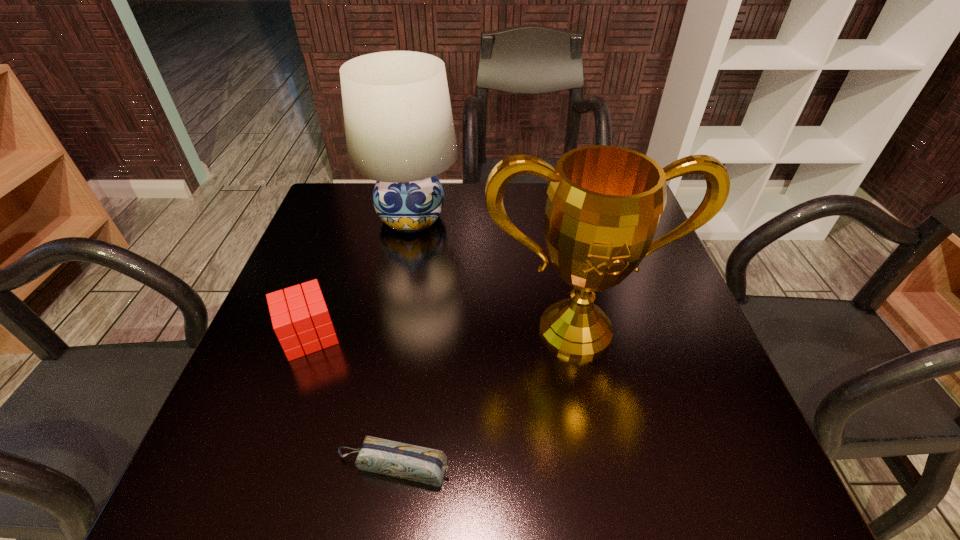
This screenshot has height=540, width=960. Identify the location of lampshade. (399, 128).

Locate an element on the screen. This screenshot has width=960, height=540. award is located at coordinates (604, 203).

Locate an element on the screen. The width and height of the screenshot is (960, 540). cube is located at coordinates (298, 320).

You are a GUI agent. You are given a task and a screenshot of the screen. Output one action in this format:
    pyautogui.click(x=<x>, y=<y>)
    Task: Click on the nearest object
    This screenshot has height=540, width=960.
    Given the screenshot: What is the action you would take?
    pyautogui.click(x=425, y=465)

Identify the location of pencil box. click(425, 465).

Locate an element on the screen. The width and height of the screenshot is (960, 540). vacant area situated 0.200m on the front-facing side of the lampshade is located at coordinates (395, 307).

At what (x,y) coordinates should I click in order to perform the action: click on vacant space located 0.130m on the front-facing side of the rightmost object. Please return your answer as a coordinate pair (x, y). The width and height of the screenshot is (960, 540). Looking at the image, I should click on (596, 430).

Where is `free region located 0.220m on the right of the third tallest object`? This screenshot has height=540, width=960. free region located 0.220m on the right of the third tallest object is located at coordinates (448, 335).

Locate an element on the screen. Image resolution: width=960 pixels, height=540 pixels. vacant area situated on the back of the shortest object is located at coordinates (414, 327).

Where is `object that is positioned at the far edge`? Image resolution: width=960 pixels, height=540 pixels. object that is positioned at the far edge is located at coordinates (399, 128).